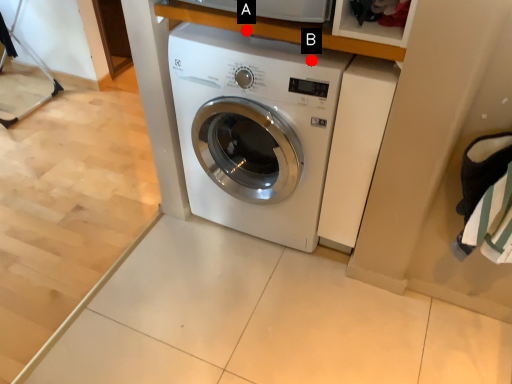
Question: Two points are circled on the image, labeled by A and B beside each circle. Which point is closer to the camera?

Choices:
 (A) A is closer
 (B) B is closer

Answer: (A)